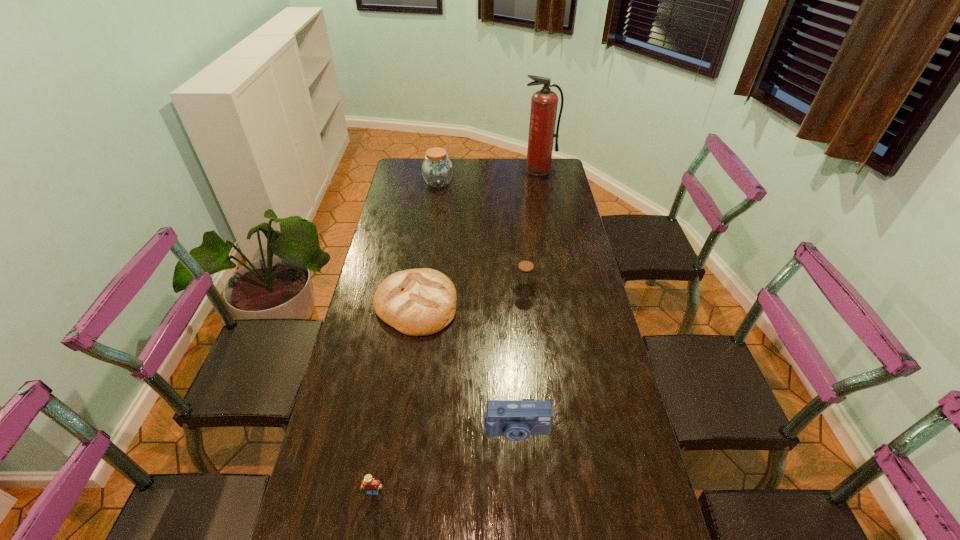
The image size is (960, 540). Identify the location of vacant region located 0.090m on the left of the farther jar. (404, 183).

I want to click on vacant space situated on the back of the nearer jar, so click(x=520, y=259).

Image resolution: width=960 pixels, height=540 pixels. I want to click on free spot located 0.160m on the lens of the camera, so click(521, 507).

The width and height of the screenshot is (960, 540). In order to click on free space located on the front of the bread in this screenshot , I will do coord(398,417).

Find the location of a particular element. vacant space located 0.070m on the front-facing side of the Lego is located at coordinates (367, 528).

Find the location of a particular element. The width and height of the screenshot is (960, 540). fire extinguisher that is at the far edge is located at coordinates (544, 103).

Identify the location of jar located in the far edge section of the desktop. This screenshot has height=540, width=960. click(x=437, y=170).

I want to click on jar present at the left edge, so click(437, 170).

At what (x,y) coordinates should I click in order to perform the action: click on bread that is at the left edge. Please return your answer as a coordinate pair (x, y). The image size is (960, 540). Looking at the image, I should click on (417, 302).

The height and width of the screenshot is (540, 960). I want to click on Lego located at the left edge, so click(369, 483).